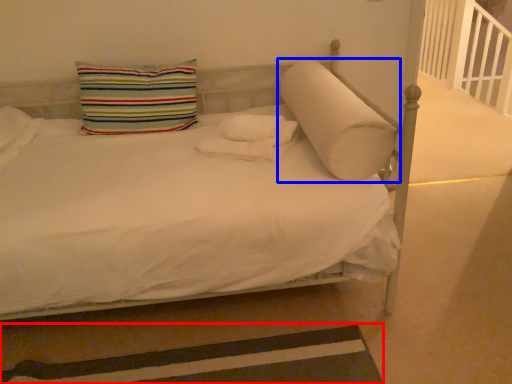
Question: Among these objects, which one is nearest to the camera, strip (highlighted by a red box) or pillow (highlighted by a blue box)?

Choices:
 (A) strip
 (B) pillow

Answer: (A)